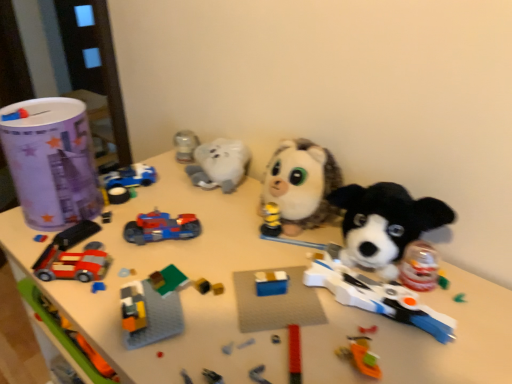
The height and width of the screenshot is (384, 512). Find the location of `unoccupied space behind brick-like plastic car at lower left, the 2th toy in the left-to-right sequence`. unoccupied space behind brick-like plastic car at lower left, the 2th toy in the left-to-right sequence is located at coordinates (106, 223).